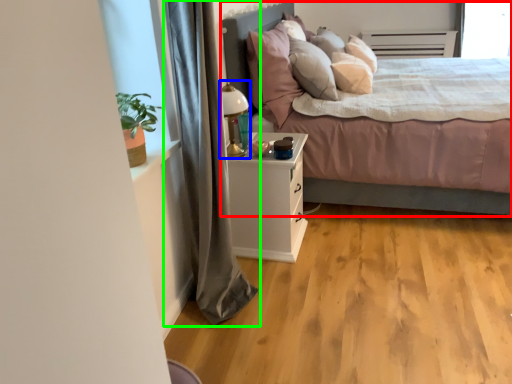
Question: Which object is the closest to the bed (highlighted by a red box)? Choose among these: table lamp (highlighted by a blue box) or curtain (highlighted by a green box).

Choices:
 (A) table lamp
 (B) curtain

Answer: (A)